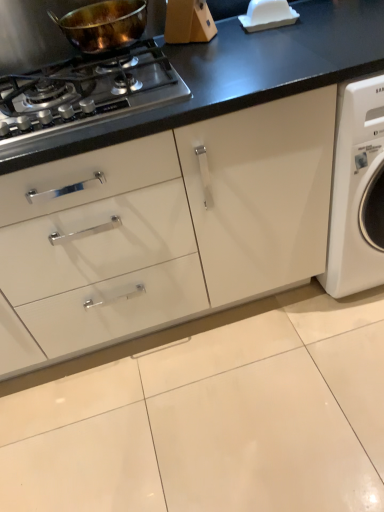
Question: From a real-world perspective, is shiny copper pan at upper left positioned over shiny metallic gas stove at upper left based on gravity?

Choices:
 (A) yes
 (B) no

Answer: (A)

Question: Is shiny copper pan at upper left outside shiny metallic gas stove at upper left?

Choices:
 (A) no
 (B) yes

Answer: (B)

Question: Does shiny copper pan at upper left have a larger size compared to shiny metallic gas stove at upper left?

Choices:
 (A) yes
 (B) no

Answer: (B)

Question: Does shiny copper pan at upper left come behind shiny metallic gas stove at upper left?

Choices:
 (A) yes
 (B) no

Answer: (A)

Question: From a real-world perspective, is shiny copper pan at upper left positioned under shiny metallic gas stove at upper left based on gravity?

Choices:
 (A) yes
 (B) no

Answer: (B)

Question: Can you confirm if shiny copper pan at upper left is thinner than shiny metallic gas stove at upper left?

Choices:
 (A) no
 (B) yes

Answer: (B)

Question: From a real-world perspective, does shiny metallic gas stove at upper left stand above shiny copper pan at upper left?

Choices:
 (A) yes
 (B) no

Answer: (B)

Question: Would you say shiny metallic gas stove at upper left contains shiny copper pan at upper left?

Choices:
 (A) no
 (B) yes

Answer: (A)

Question: Is shiny metallic gas stove at upper left beside shiny copper pan at upper left?

Choices:
 (A) yes
 (B) no

Answer: (B)

Question: Is shiny metallic gas stove at upper left bigger than shiny copper pan at upper left?

Choices:
 (A) no
 (B) yes

Answer: (B)

Question: Is shiny metallic gas stove at upper left not near shiny copper pan at upper left?

Choices:
 (A) yes
 (B) no

Answer: (B)

Question: Is the depth of shiny metallic gas stove at upper left less than that of shiny copper pan at upper left?

Choices:
 (A) no
 (B) yes

Answer: (B)

Question: From the image's perspective, is shiny copper pan at upper left above or below shiny metallic gas stove at upper left?

Choices:
 (A) below
 (B) above

Answer: (B)